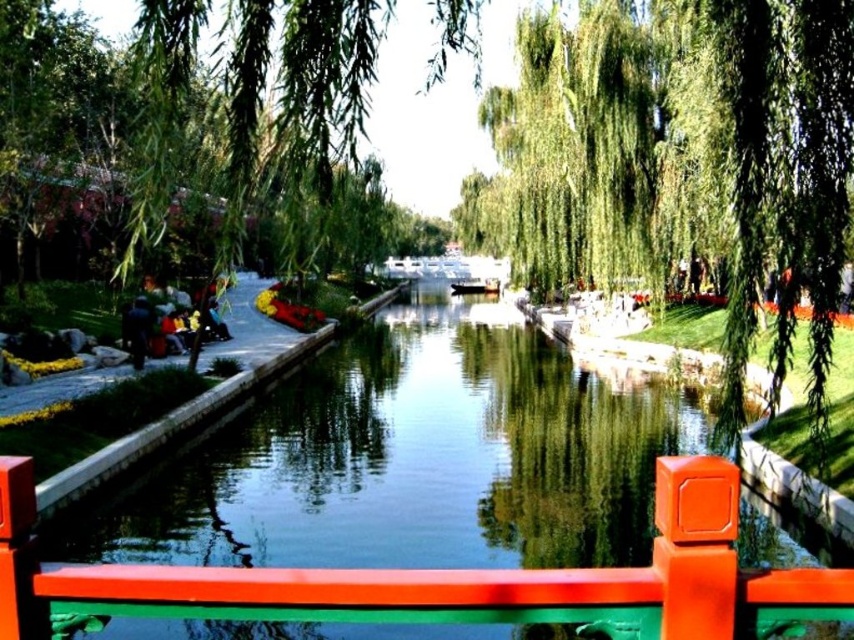
Does green leafy willow at center appear under green smooth water at center?

Incorrect, green leafy willow at center is not positioned below green smooth water at center.

Does green leafy willow at center have a smaller size compared to green smooth water at center?

Incorrect, green leafy willow at center is not smaller in size than green smooth water at center.

Who is more distant from viewer, (x=635, y=205) or (x=525, y=532)?

Point (x=635, y=205)

The height and width of the screenshot is (640, 854). Identify the location of green leafy willow at center. (681, 164).

Between green leafy willow at center and green leafy willow at upper center, which one is positioned higher?

Positioned higher is green leafy willow at upper center.

Locate an element on the screen. This screenshot has width=854, height=640. green leafy willow at center is located at coordinates (681, 164).

Consider the image. Can you confirm if green smooth water at center is positioned to the left of green leafy willow at upper center?

Yes, green smooth water at center is to the left of green leafy willow at upper center.

In the scene shown: Does green smooth water at center have a greater height compared to green leafy willow at upper center?

In fact, green smooth water at center may be shorter than green leafy willow at upper center.

Does point (484, 372) come farther from viewer compared to point (638, 184)?

That is False.

Where is `green smooth water at center`? green smooth water at center is located at coordinates (428, 458).